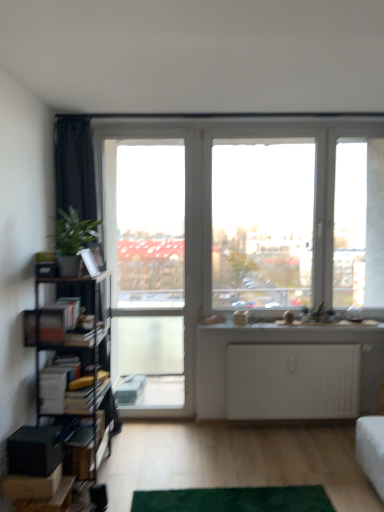
Image resolution: width=384 pixels, height=512 pixels. I want to click on blank space situated above green carpet at lower center (from a real-world perspective), so click(x=231, y=496).